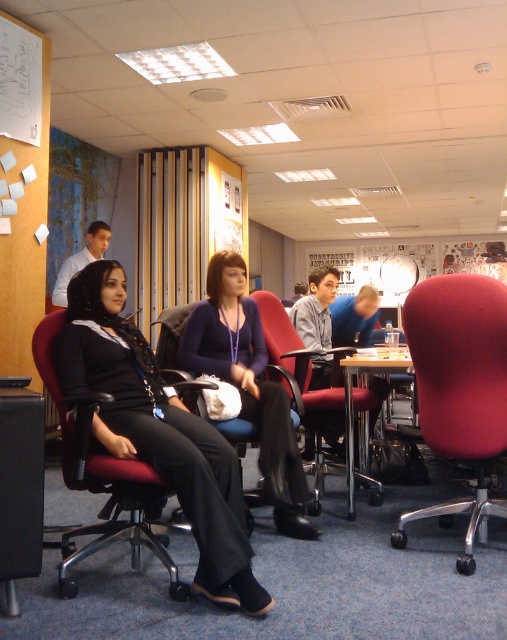
You are sitting on the wooden table at center and want to move to the smooth red swivel chair at right. Which direction should you move in to reach it?

You should move to the right to reach the smooth red swivel chair at right because it is located to the right of the wooden table at center.

You are a photographer setting up a camera to take a group photo of the three people seated on the red office chairs. The camera is positioned at the same level as the wooden table at center. Will the matte purple sweater at center be visible in the camera frame? Please explain your reasoning.

The matte purple sweater at center is taller than the wooden table at center. Since the camera is at the same level as the table, the sweater will be visible above the table in the frame.

You are organizing a small meeting in this office and need to place a new 1.2 meter wide desk between the smooth red swivel chair at right and the wooden table at center. Considering the size difference mentioned, will there be enough space between them to fit the desk?

The smooth red swivel chair at right is smaller than the wooden table at center. However, the exact distance between them isn t provided in the description. Without knowing the actual spacing, it s impossible to determine if the 1.2 meter desk will fit. More information about the distance between the two objects is needed to answer this accurately.